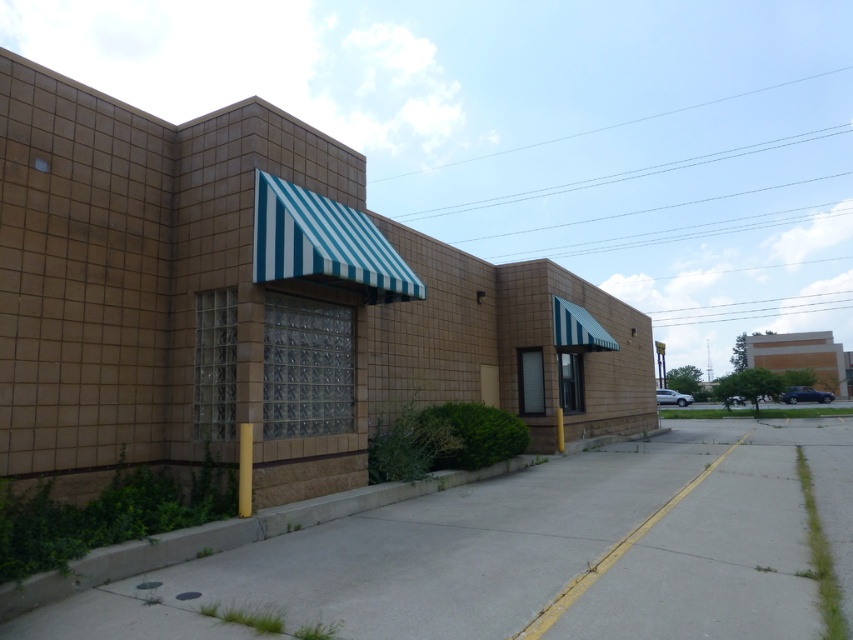
In the scene shown: You are a delivery person with a cart that requires a 10 feet clearance to maneuver. You need to navigate your cart between the brown tile building at center and the gray concrete pavement at lower center. Based on the scene, can you safely pass through the space between them?

The distance between the brown tile building at center and the gray concrete pavement at lower center is 13.86 feet, which is greater than the required 10 feet clearance. Therefore, you can safely maneuver your cart through the space between them.

You are standing on the gray concrete pavement at lower center and looking up at the brown tile building at center. Which object is taller?

The brown tile building at center is taller than the gray concrete pavement at lower center.